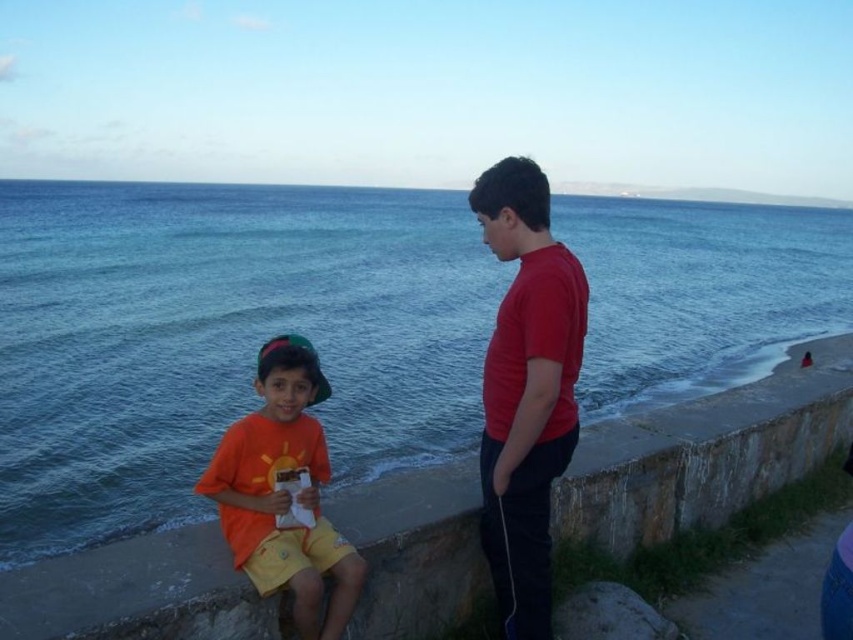
You are a photographer trying to capture a photo of the orange matte shirt at center and the blue water at sea left. Which object will occupy more space in your photo?

The blue water at sea left will occupy more space in the photo because it is bigger than the orange matte shirt at center.

You are standing at the camera position and want to throw a paper airplane to the blue water at sea left. Can you reach it with a single throw?

The blue water at sea left is 8.84 meters away from the camera, so it depends on your throwing strength. If you can throw the paper airplane that far, then yes, you can reach it. Otherwise, you might need to get closer.